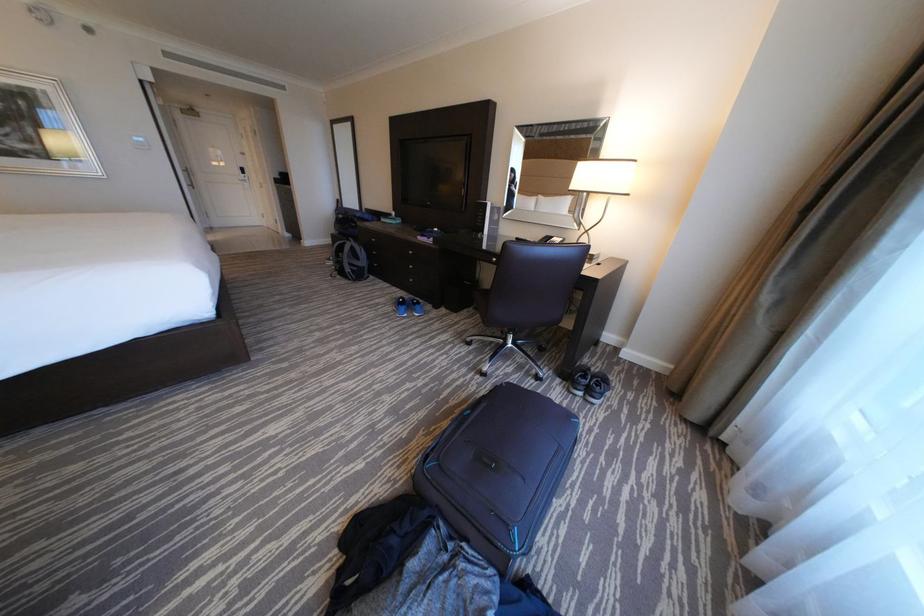
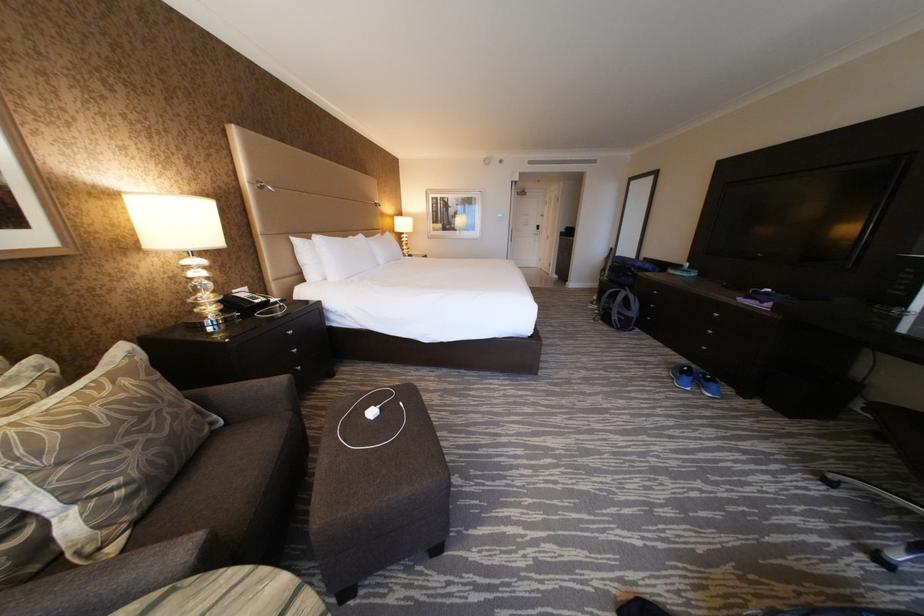
Question: Based on the continuous images, in which direction is the camera rotating? Reply with the corresponding letter.

Choices:
 (A) Left
 (B) Right
 (C) Up
 (D) Down

Answer: (A)